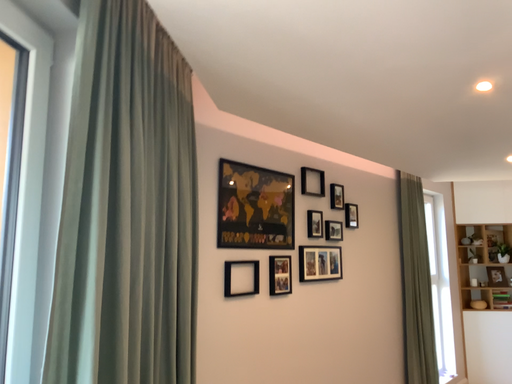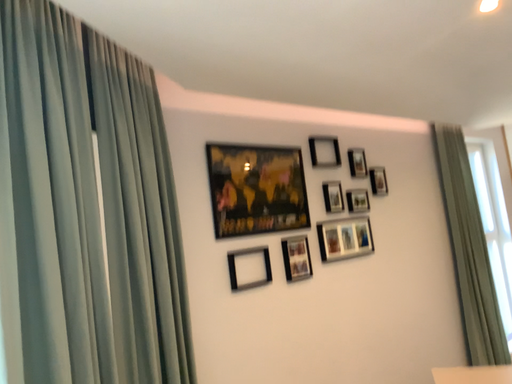
Question: How did the camera likely rotate when shooting the video?

Choices:
 (A) rotated right
 (B) rotated left

Answer: (B)